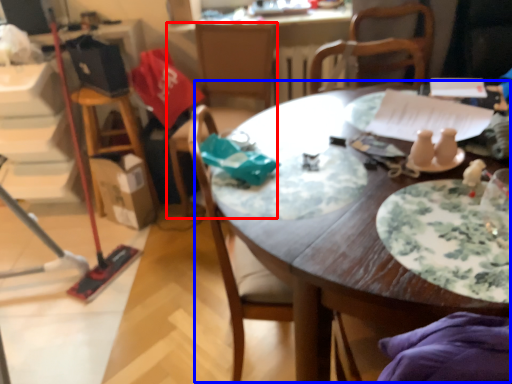
Question: Which point is further to the camera, chair (highlighted by a red box) or table (highlighted by a blue box)?

Choices:
 (A) chair
 (B) table

Answer: (A)